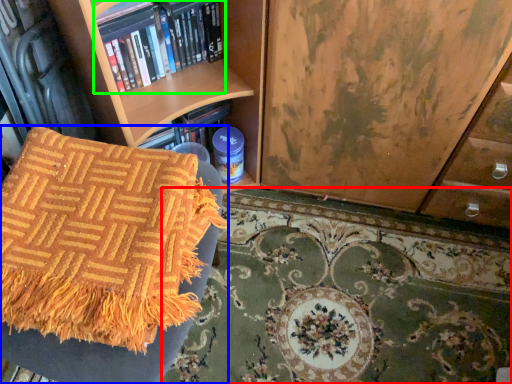
Question: Which is nearer to the mat (highlighted by a red box)? furniture (highlighted by a blue box) or book (highlighted by a green box).

Choices:
 (A) furniture
 (B) book

Answer: (A)